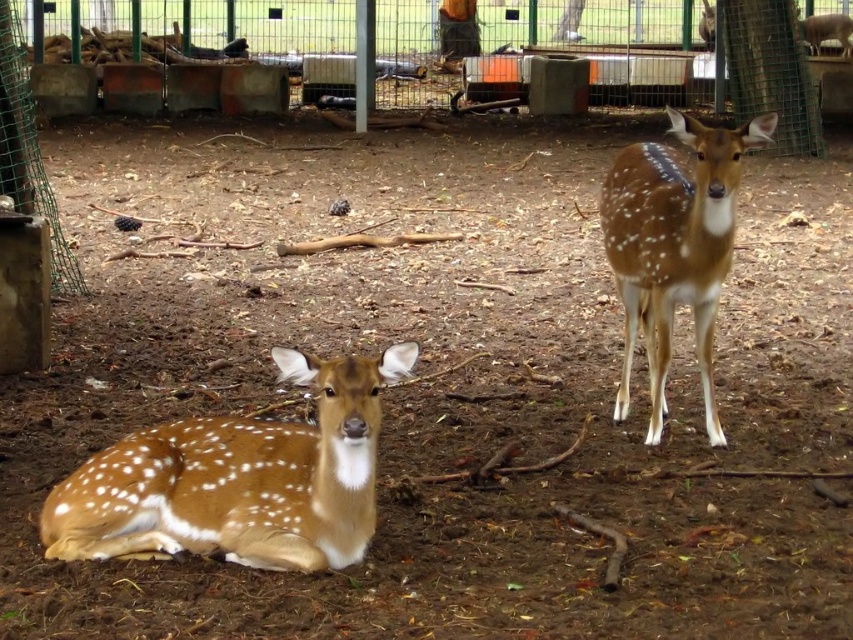
Question: Considering the relative positions of brown speckled fur at lower left and brown spotted fur at right in the image provided, where is brown speckled fur at lower left located with respect to brown spotted fur at right?

Choices:
 (A) right
 (B) left

Answer: (B)

Question: Does brown speckled fur at lower left appear over brown spotted fur at right?

Choices:
 (A) no
 (B) yes

Answer: (A)

Question: Which point is farther from the camera taking this photo?

Choices:
 (A) [260, 422]
 (B) [711, 419]

Answer: (B)

Question: Where is brown speckled fur at lower left located in relation to brown spotted fur at right in the image?

Choices:
 (A) above
 (B) below

Answer: (B)